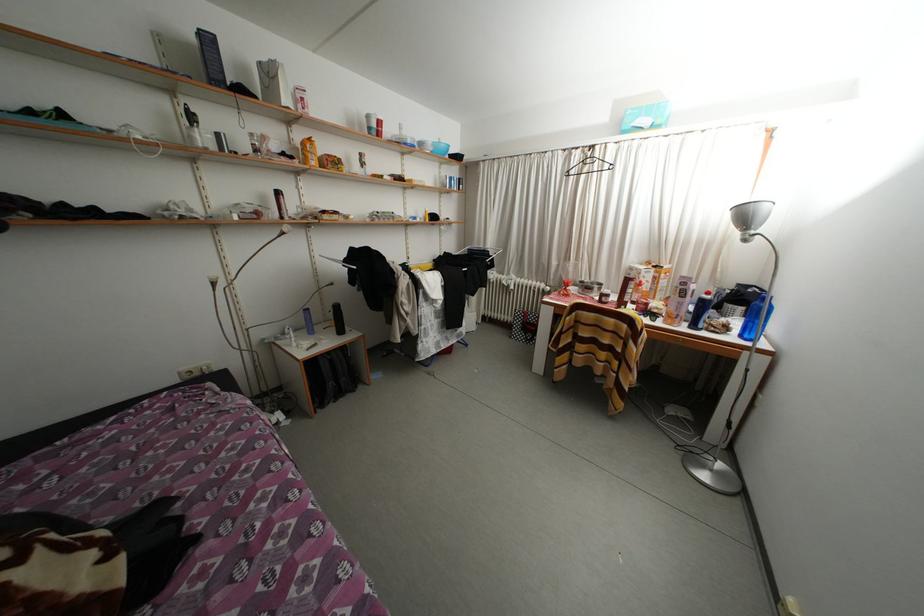
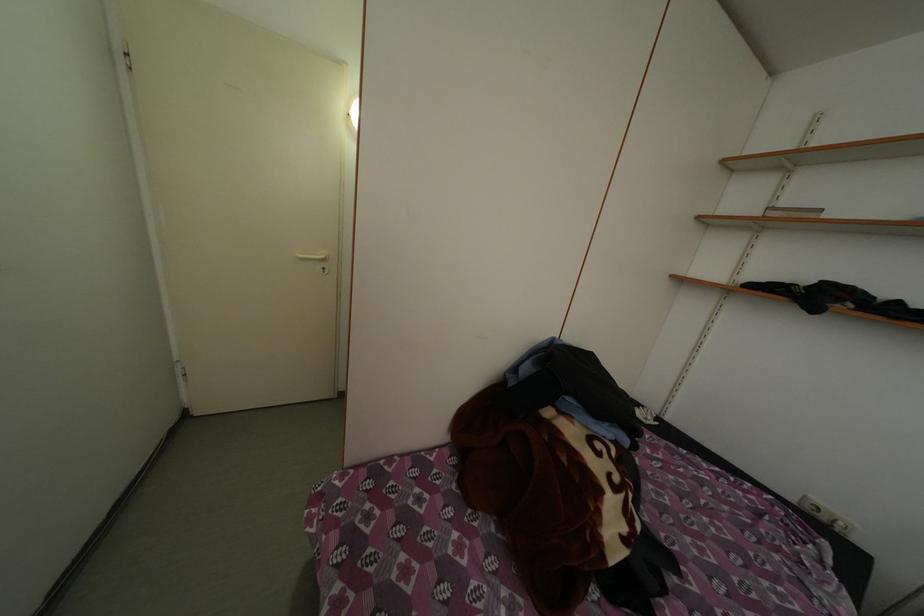
How did the camera likely rotate?

The camera's rotation is toward left-down.